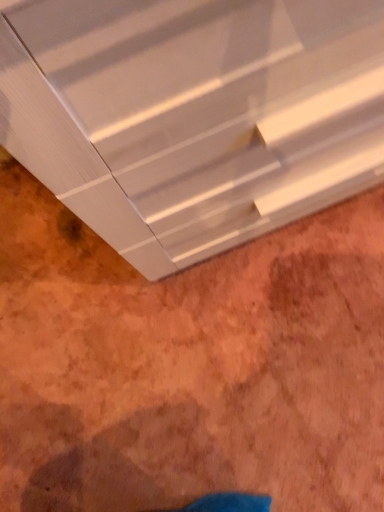
Question: Should I look upward or downward to see glossy white chest of drawers at upper center?

Choices:
 (A) down
 (B) up

Answer: (B)